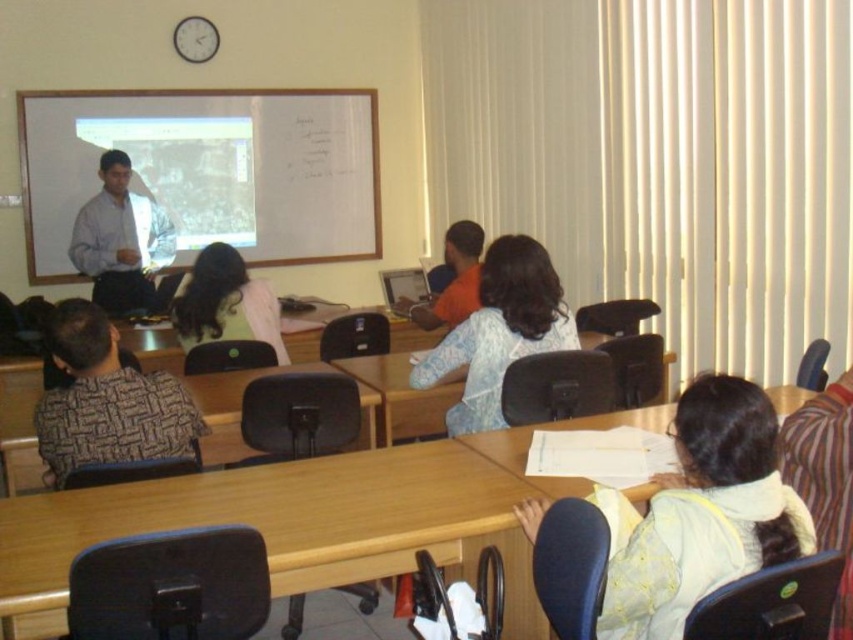
Question: Which of the following is the farthest from the observer?

Choices:
 (A) light blue fabric shirt at center
 (B) patterned fabric shirt at left
 (C) whiteboard at upper left
 (D) light brown fabric shirt at center

Answer: (C)

Question: Can you confirm if patterned fabric shirt at left is positioned below orange fabric shirt at center?

Choices:
 (A) no
 (B) yes

Answer: (B)

Question: Which object is farther from the camera taking this photo?

Choices:
 (A) light blue shirt at upper left
 (B) patterned fabric shirt at left

Answer: (A)

Question: Does whiteboard at upper left have a smaller size compared to light yellow fabric at lower right?

Choices:
 (A) yes
 (B) no

Answer: (B)

Question: Does light blue fabric shirt at center appear on the right side of light blue shirt at upper left?

Choices:
 (A) no
 (B) yes

Answer: (B)

Question: Which object appears farthest from the camera in this image?

Choices:
 (A) whiteboard at upper left
 (B) light brown fabric shirt at center
 (C) light blue fabric shirt at center

Answer: (A)